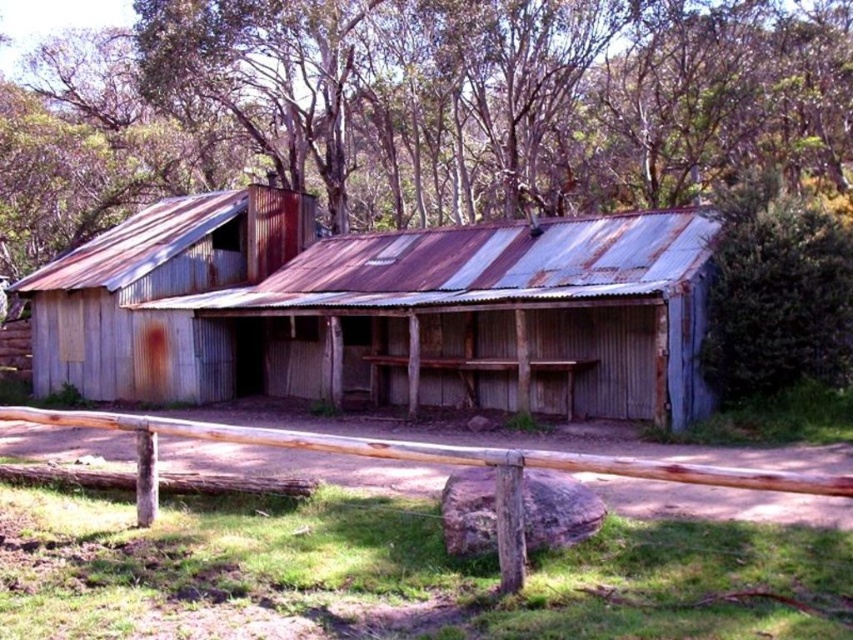
You are standing in front of the rusty corrugated metal hut at center and want to walk to the green leafy bush at upper right. Which direction should you head towards?

The rusty corrugated metal hut at center is to the left of green leafy bush at upper right, so you should head towards the right to reach the green leafy bush at upper right.

You are planning to place a small garden shed in your backyard. You have two options based on the image provided. The first option is the rusty corrugated metal hut at center, and the second is the brown wooden fence at lower center. Which of these two structures would be more suitable if you need a larger storage space?

The rusty corrugated metal hut at center is larger in size than the brown wooden fence at lower center, making it more suitable for larger storage needs.